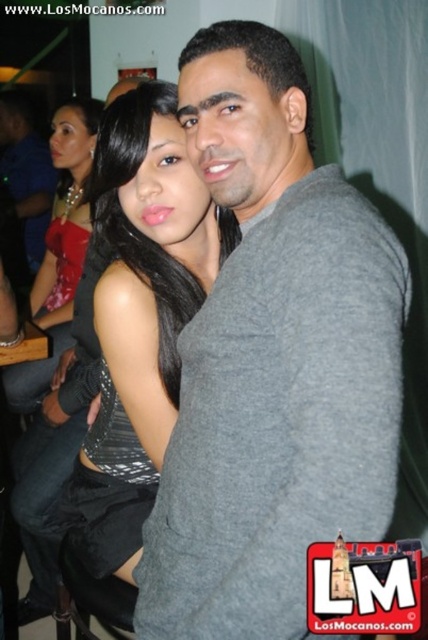
Question: Does gray cotton shirt at center have a larger size compared to satin silver dress at center?

Choices:
 (A) no
 (B) yes

Answer: (B)

Question: Is satin silver dress at center positioned behind shiny red dress at upper left?

Choices:
 (A) yes
 (B) no

Answer: (B)

Question: Is gray cotton shirt at center thinner than satin silver dress at center?

Choices:
 (A) no
 (B) yes

Answer: (A)

Question: Which object is the closest to the gray cotton shirt at center?

Choices:
 (A) satin silver dress at center
 (B) shiny red dress at upper left

Answer: (A)

Question: Among these objects, which one is nearest to the camera?

Choices:
 (A) gray cotton shirt at center
 (B) shiny red dress at upper left
 (C) satin silver dress at center

Answer: (A)

Question: Which point is farther to the camera?

Choices:
 (A) shiny red dress at upper left
 (B) satin silver dress at center

Answer: (A)